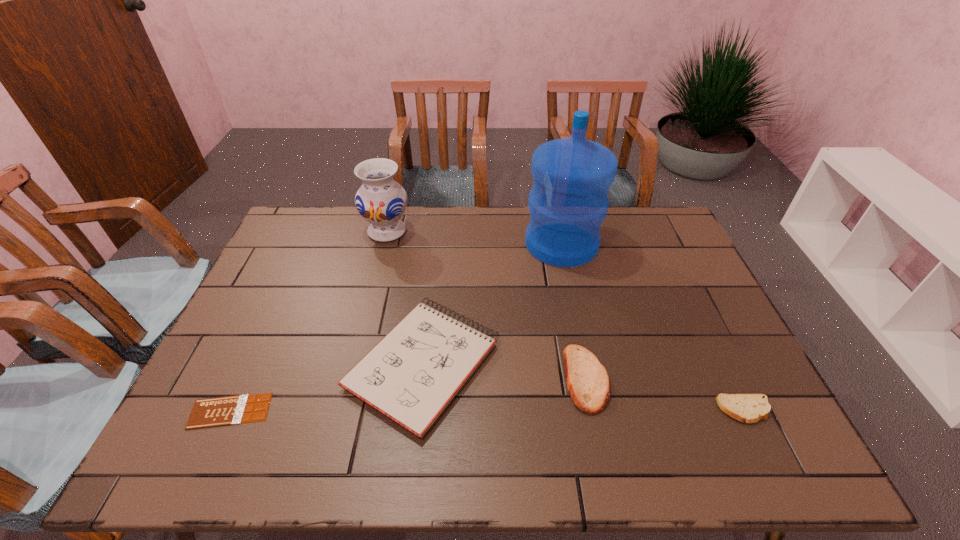
I want to click on free space at the near edge of the desktop, so click(375, 454).

Where is `free region at the left edge of the desktop`? The height and width of the screenshot is (540, 960). free region at the left edge of the desktop is located at coordinates (279, 274).

In the image, there is a desktop. Identify the location of free region at the right edge. The height and width of the screenshot is (540, 960). (643, 253).

Locate an element on the screen. free space at the far left corner of the desktop is located at coordinates (326, 241).

I want to click on vacant region between the shortest object and the right pita bread, so click(x=488, y=410).

You are a GUI agent. You are given a task and a screenshot of the screen. Output one action in this format:
    pyautogui.click(x=<x>, y=<y>)
    Task: Click on the vacant point located between the fifth tallest object and the second tallest object
    This screenshot has width=960, height=540.
    Given the screenshot: What is the action you would take?
    pyautogui.click(x=565, y=321)

This screenshot has width=960, height=540. Find the location of `vacant area that lies between the second tallest object and the notepad`. vacant area that lies between the second tallest object and the notepad is located at coordinates (405, 298).

You are a GUI agent. You are given a task and a screenshot of the screen. Output one action in this format:
    pyautogui.click(x=<x>, y=<y>)
    Task: Click on the free space between the rightmost object and the fifth shortest object
    The width and height of the screenshot is (960, 540).
    Given the screenshot: What is the action you would take?
    pyautogui.click(x=565, y=321)

At what (x,y) coordinates should I click in order to perform the action: click on empty location between the notepad and the fifth shortest object. Please return your answer as a coordinate pair (x, y). Looking at the image, I should click on (405, 298).

The height and width of the screenshot is (540, 960). In order to click on free area in between the second tallest object and the taller pita bread in this screenshot , I will do `click(487, 305)`.